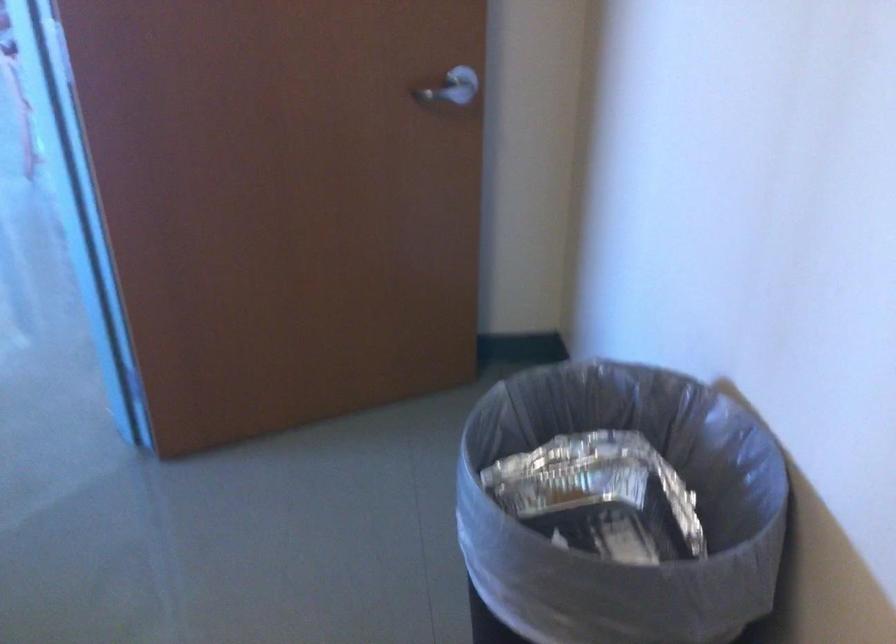
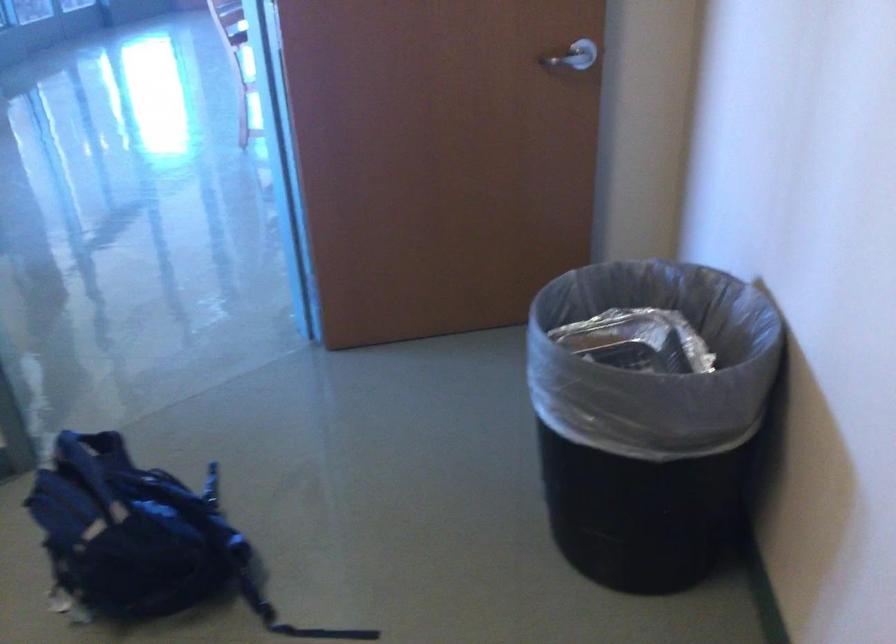
Question: How did the camera likely rotate?

Choices:
 (A) Left
 (B) Right
 (C) Up
 (D) Down

Answer: (A)